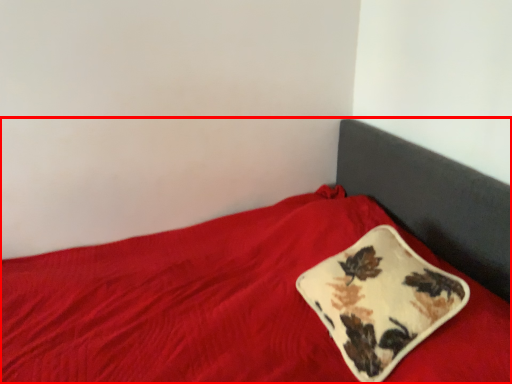
Question: In this image, where is bed (annotated by the red box) located relative to pillow?

Choices:
 (A) right
 (B) left

Answer: (B)